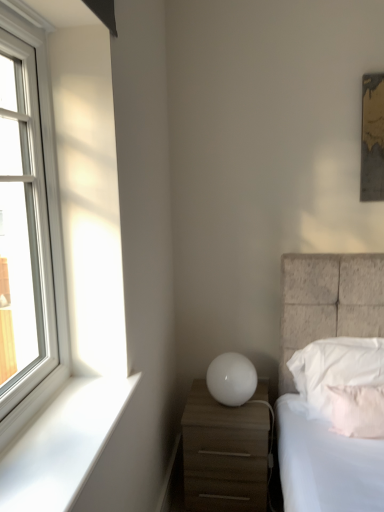
Question: Should I look upward or downward to see white matte nightstand at lower right?

Choices:
 (A) up
 (B) down

Answer: (B)

Question: Is white smooth window sill at lower left completely or partially inside pink fabric pillow at lower right, which appears as the 2th pillow when viewed from the back?

Choices:
 (A) no
 (B) yes

Answer: (A)

Question: Is pink fabric pillow at lower right, which appears as the 2th pillow when viewed from the back, oriented away from white smooth window sill at lower left?

Choices:
 (A) yes
 (B) no

Answer: (B)

Question: Is pink fabric pillow at lower right, which appears as the 2th pillow when viewed from the back, with white smooth window sill at lower left?

Choices:
 (A) yes
 (B) no

Answer: (B)

Question: Is pink fabric pillow at lower right, the first pillow when ordered from front to back, thinner than white smooth window sill at lower left?

Choices:
 (A) no
 (B) yes

Answer: (B)

Question: From the image's perspective, is pink fabric pillow at lower right, the first pillow when ordered from front to back, on white smooth window sill at lower left?

Choices:
 (A) no
 (B) yes

Answer: (A)

Question: From the image's perspective, would you say pink fabric pillow at lower right, which appears as the 2th pillow when viewed from the back, is shown under white smooth window sill at lower left?

Choices:
 (A) yes
 (B) no

Answer: (A)

Question: Does white smooth window sill at lower left have a lesser height compared to white soft pillow at right, which is the 2th pillow in front-to-back order?

Choices:
 (A) yes
 (B) no

Answer: (A)

Question: Is white smooth window sill at lower left located outside white soft pillow at right, which is the 2th pillow in front-to-back order?

Choices:
 (A) yes
 (B) no

Answer: (A)

Question: Is white smooth window sill at lower left far from white soft pillow at right, which is the 2th pillow in front-to-back order?

Choices:
 (A) yes
 (B) no

Answer: (A)

Question: Can you confirm if white smooth window sill at lower left is taller than white soft pillow at right, which is the 2th pillow in front-to-back order?

Choices:
 (A) yes
 (B) no

Answer: (B)

Question: Does white smooth window sill at lower left have a smaller size compared to white soft pillow at right, which is the 2th pillow in front-to-back order?

Choices:
 (A) yes
 (B) no

Answer: (A)

Question: Does white smooth window sill at lower left turn towards white soft pillow at right, the first pillow when ordered from back to front?

Choices:
 (A) no
 (B) yes

Answer: (A)

Question: Is white glass window at left facing away from white smooth window sill at lower left?

Choices:
 (A) yes
 (B) no

Answer: (B)